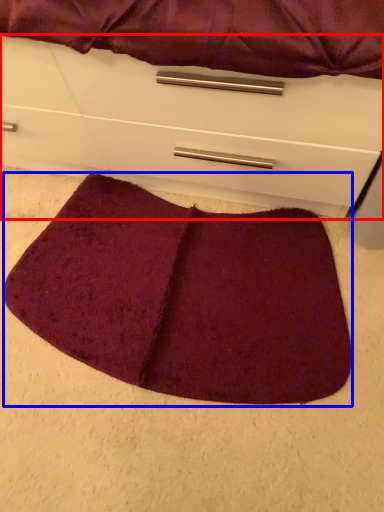
Question: Which object is closer to the camera taking this photo, chest of drawers (highlighted by a red box) or mat (highlighted by a blue box)?

Choices:
 (A) chest of drawers
 (B) mat

Answer: (A)